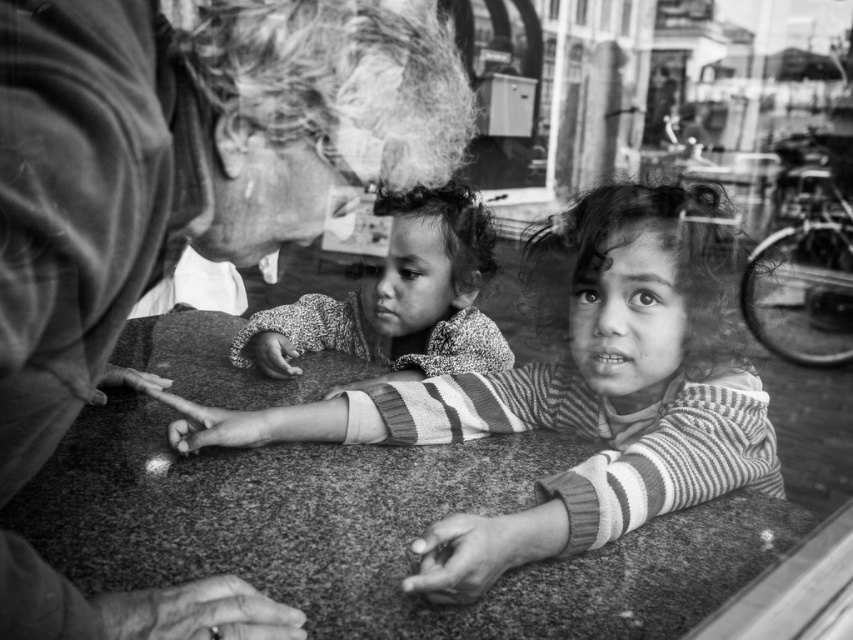
Question: Can you confirm if striped sweater at center is smaller than speckled sweater at center?

Choices:
 (A) no
 (B) yes

Answer: (A)

Question: Does smooth textured hair at upper left have a smaller size compared to striped sweater at center?

Choices:
 (A) no
 (B) yes

Answer: (B)

Question: Which point is closer to the camera taking this photo?

Choices:
 (A) (585, 356)
 (B) (393, 225)

Answer: (A)

Question: Which is farther from the speckled sweater at center?

Choices:
 (A) striped sweater at center
 (B) smooth textured hair at upper left

Answer: (B)

Question: Which point appears closest to the camera in this image?

Choices:
 (A) (38, 442)
 (B) (764, 472)
 (C) (479, 266)

Answer: (A)

Question: Can you confirm if smooth textured hair at upper left is positioned above speckled sweater at center?

Choices:
 (A) yes
 (B) no

Answer: (B)